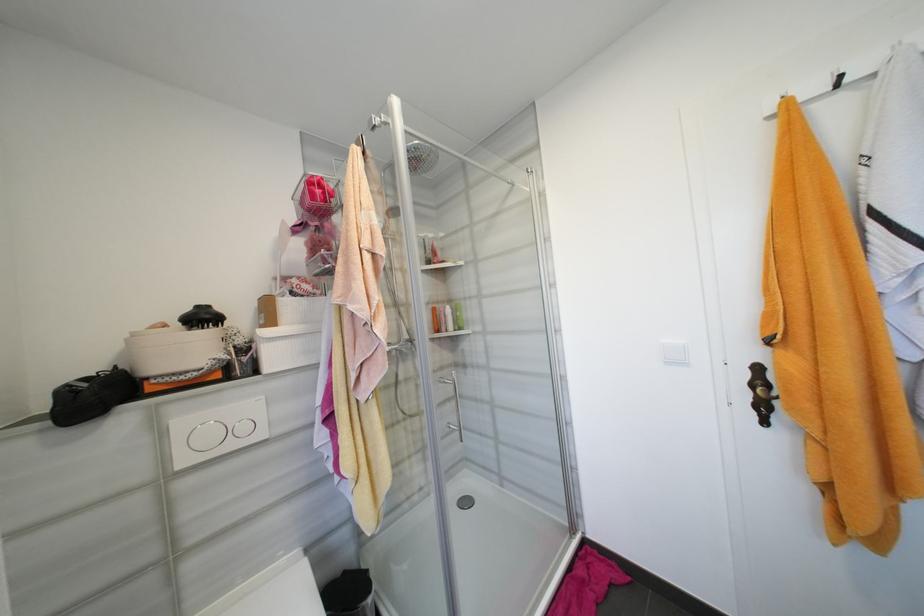
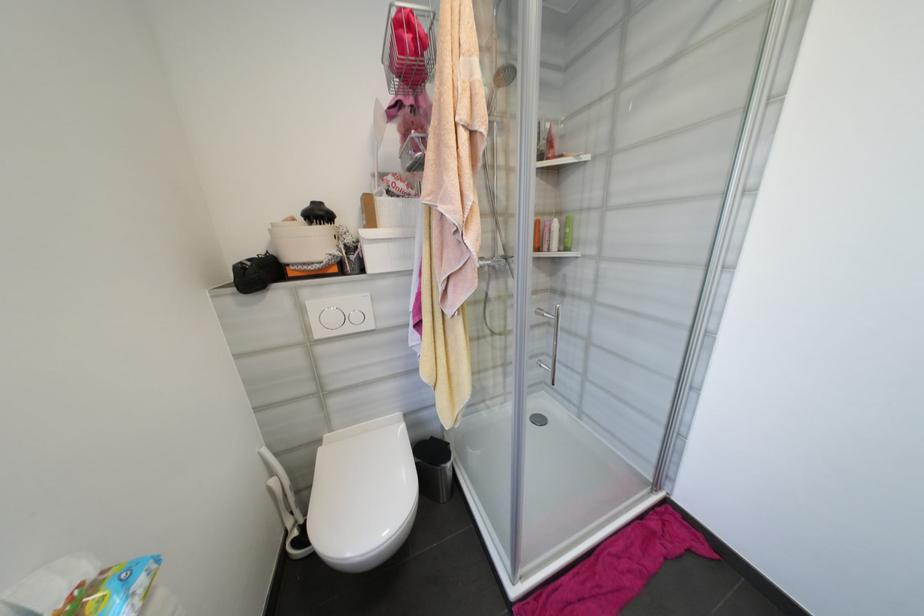
Locate, in the second image, the point that corresponds to point (463, 329) in the first image.

(567, 249)